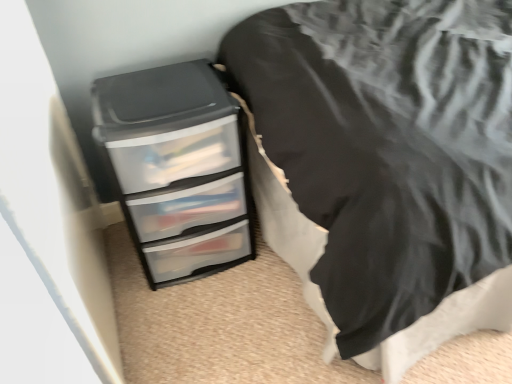
Question: Is clear plastic chest of drawers at lower left behind clear plastic drawers at lower left?

Choices:
 (A) yes
 (B) no

Answer: (A)

Question: Does clear plastic chest of drawers at lower left have a larger size compared to clear plastic drawers at lower left?

Choices:
 (A) no
 (B) yes

Answer: (A)

Question: Is clear plastic drawers at lower left a part of clear plastic chest of drawers at lower left?

Choices:
 (A) no
 (B) yes

Answer: (A)

Question: Does clear plastic chest of drawers at lower left have a greater height compared to clear plastic drawers at lower left?

Choices:
 (A) yes
 (B) no

Answer: (B)

Question: From the image's perspective, is clear plastic chest of drawers at lower left located beneath clear plastic drawers at lower left?

Choices:
 (A) no
 (B) yes

Answer: (B)

Question: Can you confirm if clear plastic chest of drawers at lower left is wider than clear plastic drawers at lower left?

Choices:
 (A) yes
 (B) no

Answer: (B)

Question: From the image's perspective, is clear plastic drawers at lower left below clear plastic chest of drawers at lower left?

Choices:
 (A) yes
 (B) no

Answer: (B)

Question: Is clear plastic chest of drawers at lower left at the back of clear plastic drawers at lower left?

Choices:
 (A) yes
 (B) no

Answer: (B)

Question: Is the depth of clear plastic drawers at lower left greater than that of clear plastic chest of drawers at lower left?

Choices:
 (A) no
 (B) yes

Answer: (A)

Question: From a real-world perspective, is clear plastic drawers at lower left on clear plastic chest of drawers at lower left?

Choices:
 (A) no
 (B) yes

Answer: (B)

Question: From a real-world perspective, does clear plastic drawers at lower left sit lower than clear plastic chest of drawers at lower left?

Choices:
 (A) yes
 (B) no

Answer: (B)

Question: Could you tell me if clear plastic drawers at lower left is facing clear plastic chest of drawers at lower left?

Choices:
 (A) no
 (B) yes

Answer: (B)

Question: From a real-world perspective, is clear plastic chest of drawers at lower left positioned above or below clear plastic drawers at lower left?

Choices:
 (A) above
 (B) below

Answer: (B)